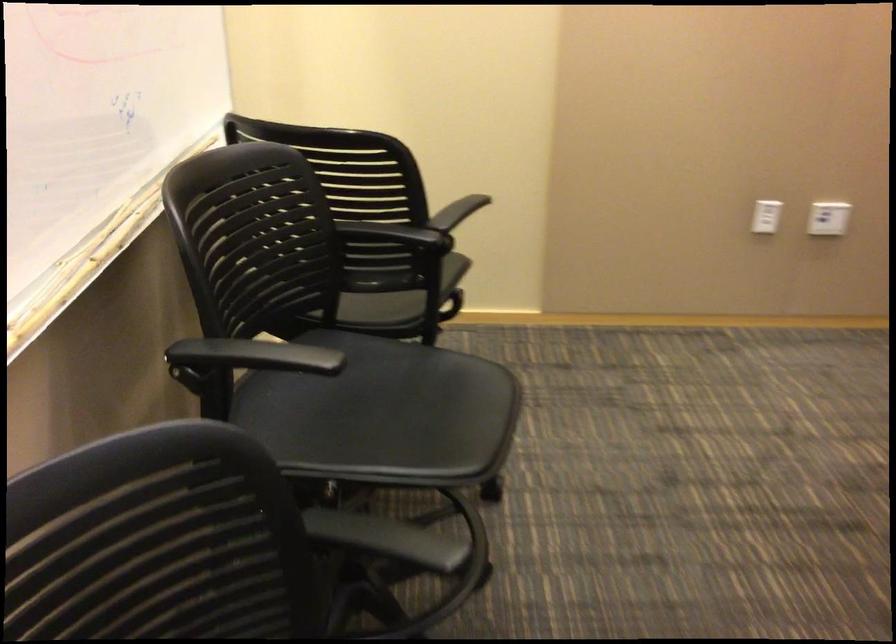
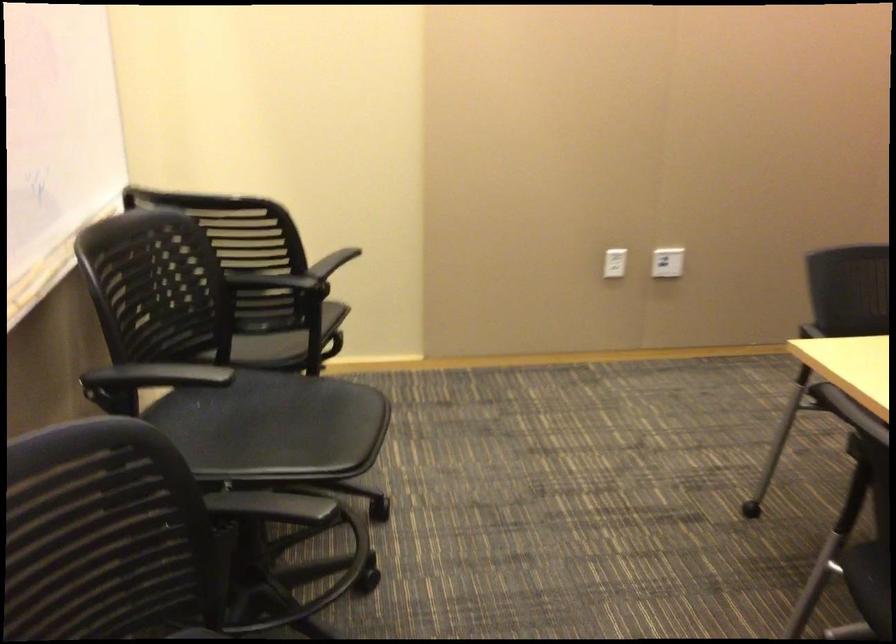
Locate, in the second image, the point that corresponds to pixel 762 219 in the first image.

(615, 263)